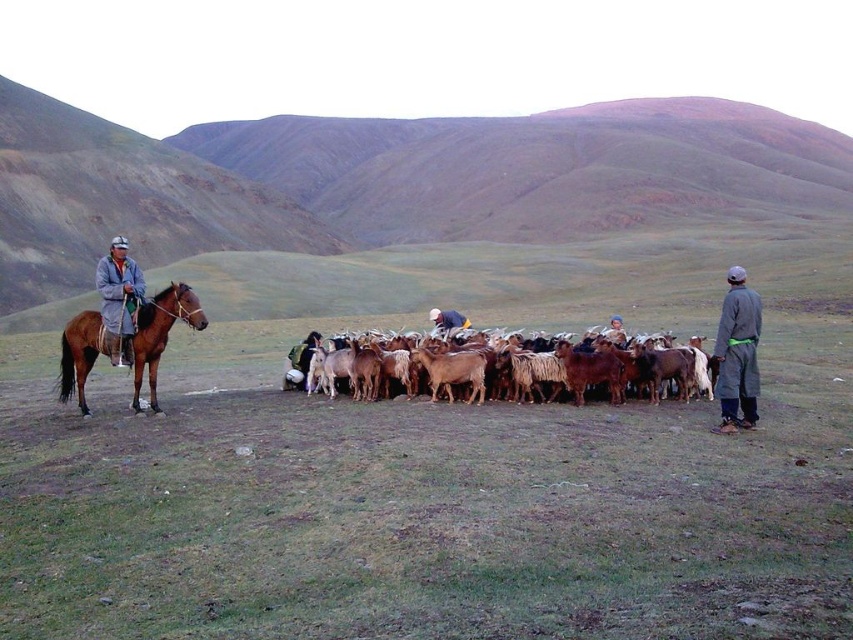
Question: Which object is the farthest from the gray woolen jacket at left?

Choices:
 (A) white woolen sweater at center
 (B) green woolen jacket at center

Answer: (A)

Question: Can you confirm if gray woolen jacket at left is bigger than green woolen jacket at center?

Choices:
 (A) yes
 (B) no

Answer: (B)

Question: Considering the real-world distances, which object is closest to the gray woolen jacket at left?

Choices:
 (A) green grassland at center
 (B) green woolen jacket at center

Answer: (B)

Question: Is gray woolen jacket at left closer to the viewer compared to green woolen jacket at center?

Choices:
 (A) no
 (B) yes

Answer: (B)

Question: Which object appears closest to the camera in this image?

Choices:
 (A) white woolen sweater at center
 (B) brown glossy horse at left
 (C) gray woolen jacket at left

Answer: (B)

Question: Does green woolen jacket at center have a smaller size compared to white woolen sweater at center?

Choices:
 (A) yes
 (B) no

Answer: (B)